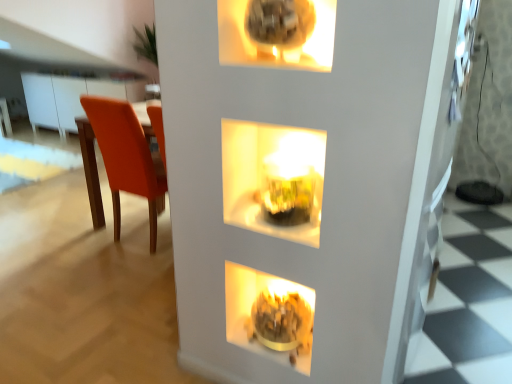
Question: Choose the correct answer: Is orange matte chair at left inside translucent glass vase at center or outside it?

Choices:
 (A) inside
 (B) outside

Answer: (B)

Question: Considering their positions, is orange matte chair at left located in front of or behind translucent glass vase at center?

Choices:
 (A) front
 (B) behind

Answer: (B)

Question: Estimate the real-world distances between objects in this image. Which object is farther from the orange matte chair at left?

Choices:
 (A) matte gold bowl at lower center
 (B) translucent glass vase at center

Answer: (A)

Question: Estimate the real-world distances between objects in this image. Which object is farther from the translucent glass vase at center?

Choices:
 (A) orange matte chair at left
 (B) matte gold bowl at lower center

Answer: (A)